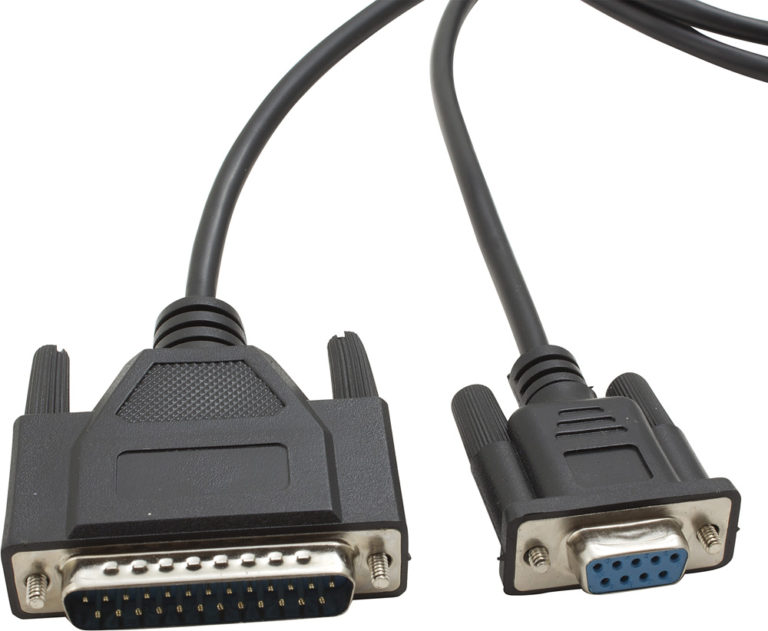
Identify the location of cord. (223, 220).